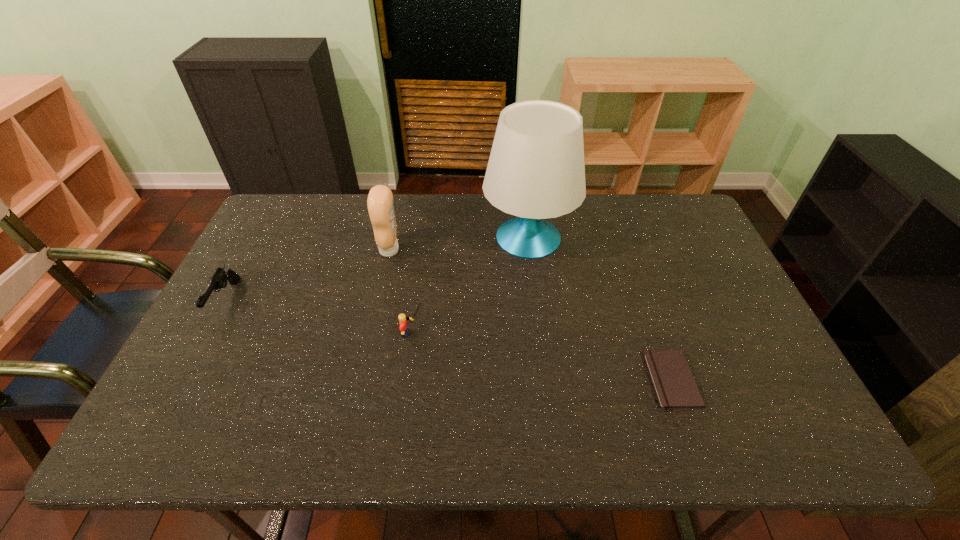
Find the location of a particular element. The image size is (960, 540). vacant space located on the front-facing side of the tallest object is located at coordinates (541, 340).

Identify the location of vacant space located on the label of the second tallest object. The height and width of the screenshot is (540, 960). (525, 250).

Locate an element on the screen. free space located 0.330m on the front-facing side of the third object from right to left is located at coordinates coord(550,333).

This screenshot has height=540, width=960. Find the location of `vacant space located 0.260m at the end of the barrel of the leftmost object`. vacant space located 0.260m at the end of the barrel of the leftmost object is located at coordinates (162, 417).

Where is `free space located 0.170m on the left of the checkbook`? This screenshot has height=540, width=960. free space located 0.170m on the left of the checkbook is located at coordinates (580, 380).

This screenshot has width=960, height=540. In order to click on object situated at the far edge in this screenshot , I will do `click(536, 170)`.

This screenshot has height=540, width=960. I want to click on object that is at the left edge, so click(x=218, y=280).

At what (x,y) coordinates should I click in order to perform the action: click on vacant space at the far edge of the desktop. Please return your answer as a coordinate pair (x, y). This screenshot has width=960, height=540. Looking at the image, I should click on (554, 222).

The width and height of the screenshot is (960, 540). I want to click on blank area at the near edge, so click(x=536, y=424).

Where is `free point at the left edge`? The width and height of the screenshot is (960, 540). free point at the left edge is located at coordinates (268, 270).